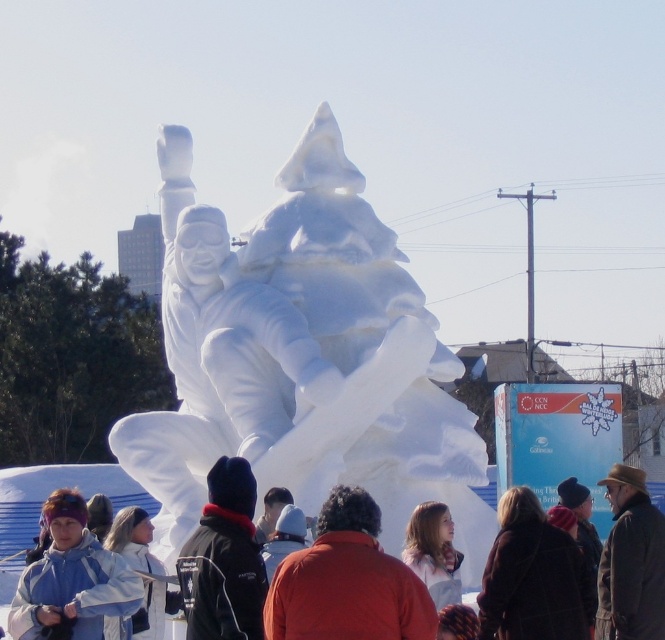
Question: Considering the relative positions of black fleece jacket at center and light brown hair at center in the image provided, where is black fleece jacket at center located with respect to light brown hair at center?

Choices:
 (A) below
 (B) above

Answer: (A)

Question: Among these points, which one is nearest to the camera?

Choices:
 (A) (410, 563)
 (B) (634, 582)

Answer: (A)

Question: Which of the following is the farthest from the observer?

Choices:
 (A) white snow sculpture at center
 (B) brown leather hat at lower right

Answer: (A)

Question: Is matte white snow sculpture at center behind light brown hair at center?

Choices:
 (A) no
 (B) yes

Answer: (B)

Question: Does black fleece jacket at center appear over white snow sculpture at lower left?

Choices:
 (A) no
 (B) yes

Answer: (B)

Question: Which point is closer to the camera?

Choices:
 (A) (245, 545)
 (B) (63, 481)
 (C) (110, 584)
 (D) (323, 605)

Answer: (D)